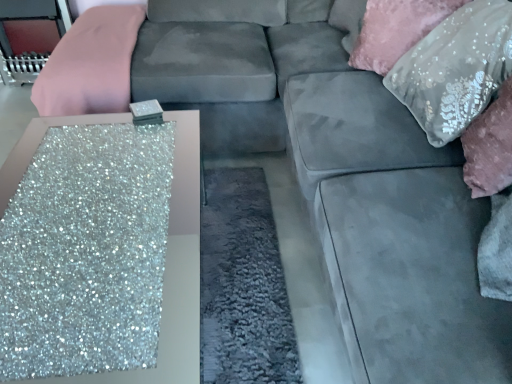
Question: Is sequined fabric pillow at upper right, arranged as the 1th pillow when viewed from the back, at the right side of satin silver pillow at upper right, the 2th pillow when ordered from back to front?

Choices:
 (A) yes
 (B) no

Answer: (B)

Question: From the image's perspective, is sequined fabric pillow at upper right, acting as the 2th pillow starting from the front, above satin silver pillow at upper right, the 2th pillow when ordered from back to front?

Choices:
 (A) yes
 (B) no

Answer: (A)

Question: Does sequined fabric pillow at upper right, arranged as the 1th pillow when viewed from the back, have a lesser width compared to satin silver pillow at upper right, positioned as the 1th pillow in front-to-back order?

Choices:
 (A) no
 (B) yes

Answer: (B)

Question: From a real-world perspective, is sequined fabric pillow at upper right, arranged as the 1th pillow when viewed from the back, under satin silver pillow at upper right, the 2th pillow when ordered from back to front?

Choices:
 (A) no
 (B) yes

Answer: (B)

Question: Could you tell me if sequined fabric pillow at upper right, arranged as the 1th pillow when viewed from the back, is turned towards satin silver pillow at upper right, the 2th pillow when ordered from back to front?

Choices:
 (A) yes
 (B) no

Answer: (A)

Question: Looking at their shapes, would you say satin silver pillow at upper right, positioned as the 1th pillow in front-to-back order, is wider or thinner than sequined fabric pillow at upper right, acting as the 2th pillow starting from the front?

Choices:
 (A) thin
 (B) wide

Answer: (B)

Question: Considering the positions of satin silver pillow at upper right, the 2th pillow when ordered from back to front, and sequined fabric pillow at upper right, acting as the 2th pillow starting from the front, in the image, is satin silver pillow at upper right, the 2th pillow when ordered from back to front, taller or shorter than sequined fabric pillow at upper right, acting as the 2th pillow starting from the front,?

Choices:
 (A) short
 (B) tall

Answer: (B)

Question: Does point (407, 66) appear closer or farther from the camera than point (430, 23)?

Choices:
 (A) farther
 (B) closer

Answer: (A)

Question: Considering the positions of satin silver pillow at upper right, the 2th pillow when ordered from back to front, and sequined fabric pillow at upper right, acting as the 2th pillow starting from the front, in the image, is satin silver pillow at upper right, the 2th pillow when ordered from back to front, bigger or smaller than sequined fabric pillow at upper right, acting as the 2th pillow starting from the front,?

Choices:
 (A) small
 (B) big

Answer: (B)

Question: Choose the correct answer: Is satin silver pillow at upper right, the 2th pillow when ordered from back to front, inside glittery silver table at lower left or outside it?

Choices:
 (A) inside
 (B) outside

Answer: (B)

Question: Considering the positions of satin silver pillow at upper right, positioned as the 1th pillow in front-to-back order, and glittery silver table at lower left in the image, is satin silver pillow at upper right, positioned as the 1th pillow in front-to-back order, wider or thinner than glittery silver table at lower left?

Choices:
 (A) thin
 (B) wide

Answer: (A)

Question: In the image, is satin silver pillow at upper right, the 2th pillow when ordered from back to front, on the left side or the right side of glittery silver table at lower left?

Choices:
 (A) left
 (B) right

Answer: (B)

Question: Based on their sizes in the image, would you say satin silver pillow at upper right, positioned as the 1th pillow in front-to-back order, is bigger or smaller than glittery silver table at lower left?

Choices:
 (A) big
 (B) small

Answer: (B)

Question: From a real-world perspective, relative to satin silver pillow at upper right, the 2th pillow when ordered from back to front, is glittery silver table at lower left vertically above or below?

Choices:
 (A) below
 (B) above

Answer: (A)

Question: Considering the positions of glittery silver table at lower left and satin silver pillow at upper right, the 2th pillow when ordered from back to front, in the image, is glittery silver table at lower left wider or thinner than satin silver pillow at upper right, the 2th pillow when ordered from back to front,?

Choices:
 (A) wide
 (B) thin

Answer: (A)